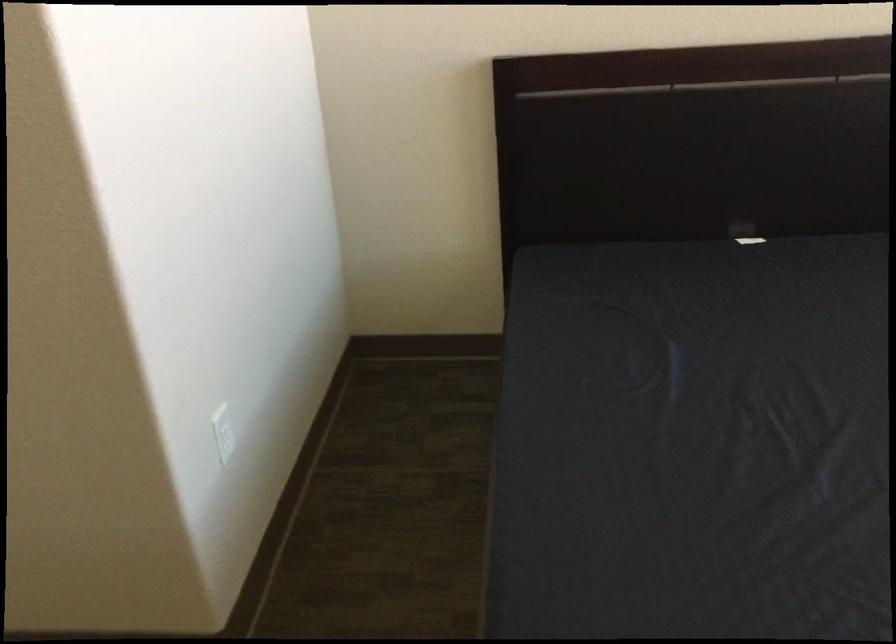
Find the location of a particular element. white electrical outlet is located at coordinates (222, 431).